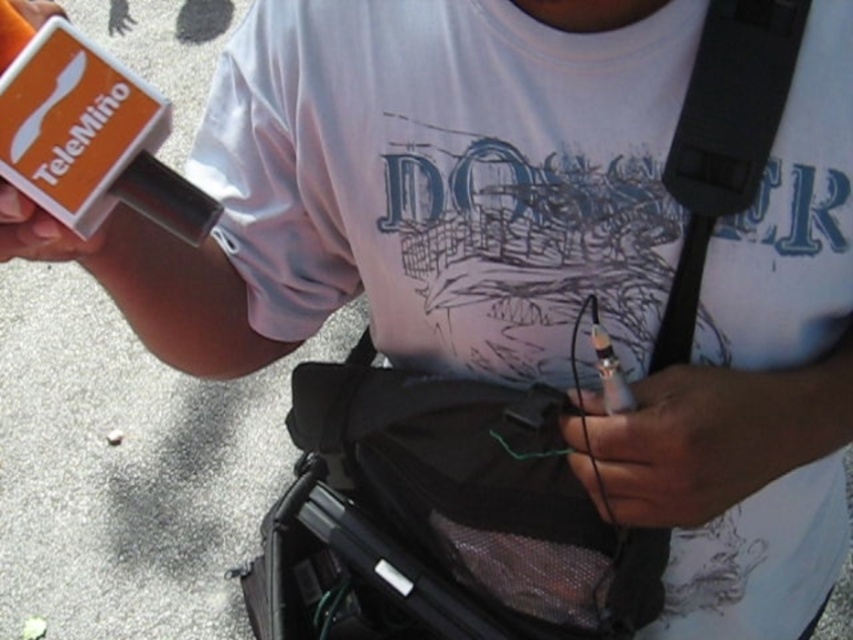
Question: Estimate the real-world distances between objects in this image. Which object is closer to the black matte strap at upper right?

Choices:
 (A) black matte pen at lower center
 (B) orange matte microphone at upper left

Answer: (A)

Question: Can you confirm if white matte t-shirt at center is positioned to the left of black matte pen at lower center?

Choices:
 (A) no
 (B) yes

Answer: (B)

Question: Which of the following is the closest to the observer?

Choices:
 (A) (772, 268)
 (B) (679, 520)

Answer: (B)

Question: Can you confirm if black matte strap at upper right is positioned to the right of orange matte microphone at upper left?

Choices:
 (A) yes
 (B) no

Answer: (A)

Question: Is white matte t-shirt at center smaller than black matte strap at upper right?

Choices:
 (A) no
 (B) yes

Answer: (A)

Question: Estimate the real-world distances between objects in this image. Which object is farther from the black matte strap at upper right?

Choices:
 (A) white matte t-shirt at center
 (B) black matte pen at lower center

Answer: (A)